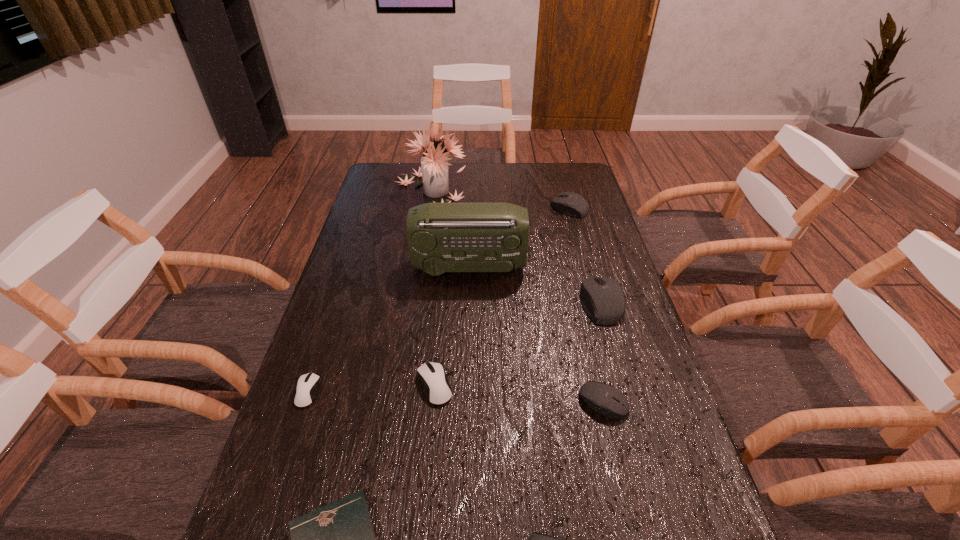
Where is `the smaller white mouse`? the smaller white mouse is located at coordinates (307, 386).

This screenshot has width=960, height=540. Identify the location of the leftmost object. (307, 386).

This screenshot has height=540, width=960. What are the coordinates of `free space located 0.310m on the front of the bouquet` in the screenshot? It's located at (416, 272).

The image size is (960, 540). In order to click on vacant position located on the front-facing side of the second tallest object in this screenshot , I will do `click(584, 267)`.

Locate an element on the screen. vacant position located on the left of the biggest black computer equipment is located at coordinates (456, 302).

You are a GUI agent. You are given a task and a screenshot of the screen. Output one action in this format:
    pyautogui.click(x=<x>, y=<y>)
    Task: Click on the vacant space positioned 0.150m on the left of the second biggest black computer equipment
    
    Given the screenshot: What is the action you would take?
    pyautogui.click(x=511, y=208)

In order to click on vacant space located on the left of the right white mouse in this screenshot , I will do `click(346, 386)`.

I want to click on vacant space located 0.310m on the back of the third biggest black computer equipment, so click(x=578, y=294).

The image size is (960, 540). I want to click on free location located 0.140m on the back of the leftmost computer equipment, so click(x=327, y=333).

Identify the location of object that is positioned at the far edge. This screenshot has height=540, width=960. (434, 166).